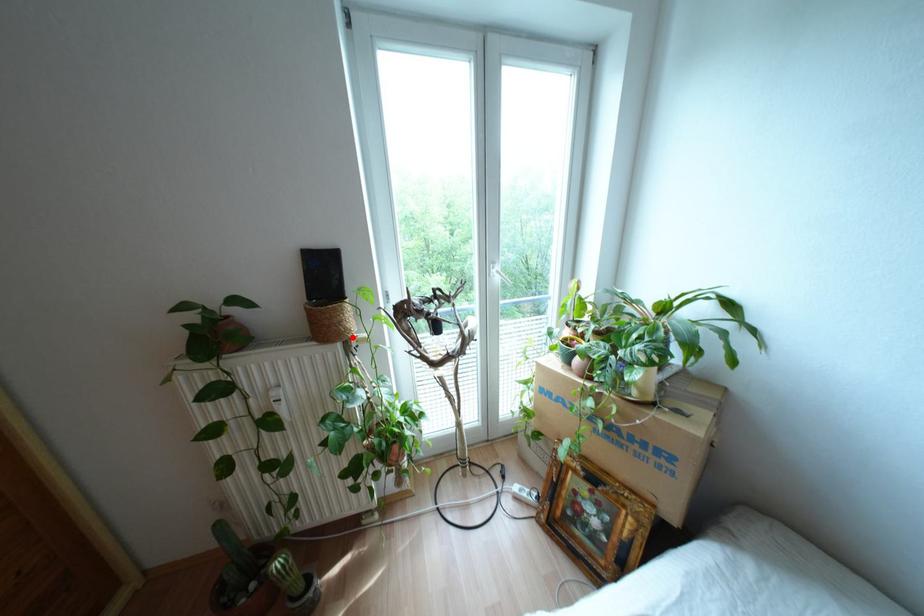
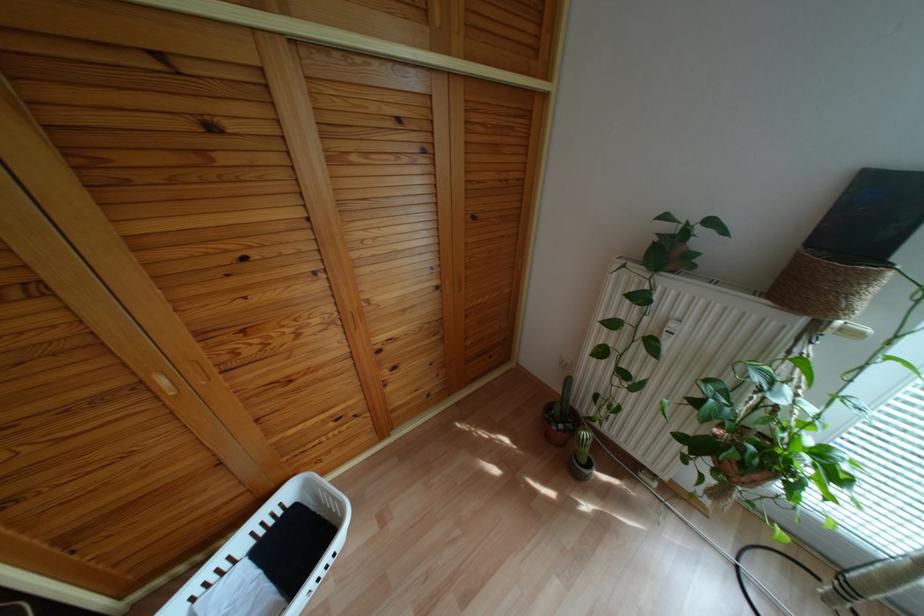
The point at the highlighted location is marked in the first image. Where is the corresponding point in the second image?

(839, 322)